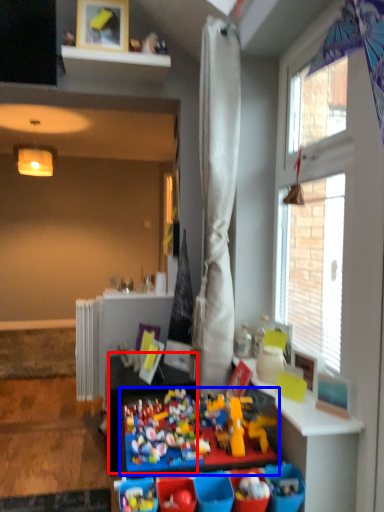
Question: Which of the following is the farthest to the observer, table (highlighted by a red box) or toy (highlighted by a blue box)?

Choices:
 (A) table
 (B) toy

Answer: (A)